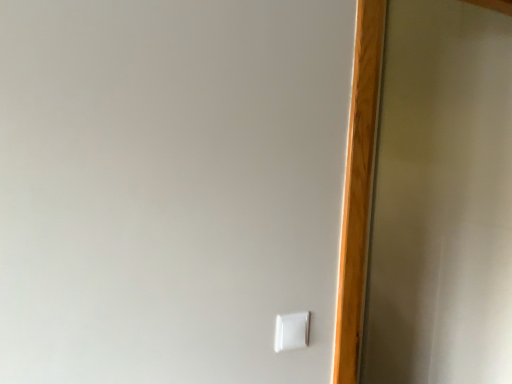
The image size is (512, 384). What do you see at coordinates (292, 331) in the screenshot? I see `white plastic light switch at lower right` at bounding box center [292, 331].

This screenshot has width=512, height=384. Identify the location of white plastic light switch at lower right. (292, 331).

The image size is (512, 384). Describe the element at coordinates (441, 199) in the screenshot. I see `transparent glass screen door at right` at that location.

Where is `transparent glass screen door at right`? transparent glass screen door at right is located at coordinates (441, 199).

Locate an element on the screen. This screenshot has width=512, height=384. white plastic light switch at lower right is located at coordinates (292, 331).

Between transparent glass screen door at right and white plastic light switch at lower right, which one appears on the right side from the viewer's perspective?

transparent glass screen door at right is more to the right.

In the scene shown: Which object is more forward, transparent glass screen door at right or white plastic light switch at lower right?

white plastic light switch at lower right is closer to the camera.

Which is in front, point (386, 35) or point (296, 317)?

The point (296, 317) is closer to the camera.

From the image's perspective, is transparent glass screen door at right positioned above or below white plastic light switch at lower right?

From the image's perspective, transparent glass screen door at right appears above white plastic light switch at lower right.

From a real-world perspective, is transparent glass screen door at right located beneath white plastic light switch at lower right?

No, from a real-world perspective, transparent glass screen door at right is not under white plastic light switch at lower right.

Considering the relative sizes of transparent glass screen door at right and white plastic light switch at lower right in the image provided, is transparent glass screen door at right thinner than white plastic light switch at lower right?

Incorrect, the width of transparent glass screen door at right is not less than that of white plastic light switch at lower right.

Considering the relative sizes of transparent glass screen door at right and white plastic light switch at lower right in the image provided, is transparent glass screen door at right shorter than white plastic light switch at lower right?

In fact, transparent glass screen door at right may be taller than white plastic light switch at lower right.

Looking at this image, can you confirm if transparent glass screen door at right is smaller than white plastic light switch at lower right?

No.

Is transparent glass screen door at right inside the boundaries of white plastic light switch at lower right, or outside?

transparent glass screen door at right exists outside the volume of white plastic light switch at lower right.

Consider the image. Are transparent glass screen door at right and white plastic light switch at lower right located far from each other?

Yes.

Is transparent glass screen door at right oriented towards white plastic light switch at lower right?

Yes, transparent glass screen door at right is oriented towards white plastic light switch at lower right.

What's the angular difference between transparent glass screen door at right and white plastic light switch at lower right's facing directions?

The angular difference between transparent glass screen door at right and white plastic light switch at lower right is 89.6 degrees.

How distant is transparent glass screen door at right from white plastic light switch at lower right?

The distance of transparent glass screen door at right from white plastic light switch at lower right is 4.96 feet.

Locate an element on the screen. This screenshot has height=384, width=512. screen door that is on the right side of white plastic light switch at lower right is located at coordinates (441, 199).

Considering the positions of objects white plastic light switch at lower right and transparent glass screen door at right in the image provided, who is more to the left, white plastic light switch at lower right or transparent glass screen door at right?

white plastic light switch at lower right.

Considering the positions of objects white plastic light switch at lower right and transparent glass screen door at right in the image provided, who is in front, white plastic light switch at lower right or transparent glass screen door at right?

white plastic light switch at lower right is more forward.

Which is behind, point (304, 319) or point (395, 85)?

Point (395, 85)

From the image's perspective, is white plastic light switch at lower right positioned above or below transparent glass screen door at right?

white plastic light switch at lower right is situated lower than transparent glass screen door at right in the image.

From a real-world perspective, is white plastic light switch at lower right on transparent glass screen door at right?

Incorrect, from a real-world perspective, white plastic light switch at lower right is lower than transparent glass screen door at right.

Considering the sizes of objects white plastic light switch at lower right and transparent glass screen door at right in the image provided, who is wider, white plastic light switch at lower right or transparent glass screen door at right?

Wider between the two is transparent glass screen door at right.

Who is taller, white plastic light switch at lower right or transparent glass screen door at right?

transparent glass screen door at right.

Who is bigger, white plastic light switch at lower right or transparent glass screen door at right?

transparent glass screen door at right is bigger.

Does white plastic light switch at lower right contain transparent glass screen door at right?

No, transparent glass screen door at right is not surrounded by white plastic light switch at lower right.

Is white plastic light switch at lower right touching transparent glass screen door at right?

No.

Looking at this image, is transparent glass screen door at right at the back of white plastic light switch at lower right?

No, white plastic light switch at lower right is not facing away from transparent glass screen door at right.

Find the location of a particular element. The height and width of the screenshot is (384, 512). screen door on the right of white plastic light switch at lower right is located at coordinates (441, 199).

This screenshot has width=512, height=384. Identify the location of screen door above the white plastic light switch at lower right (from the image's perspective). coord(441,199).

I want to click on screen door behind the white plastic light switch at lower right, so click(x=441, y=199).